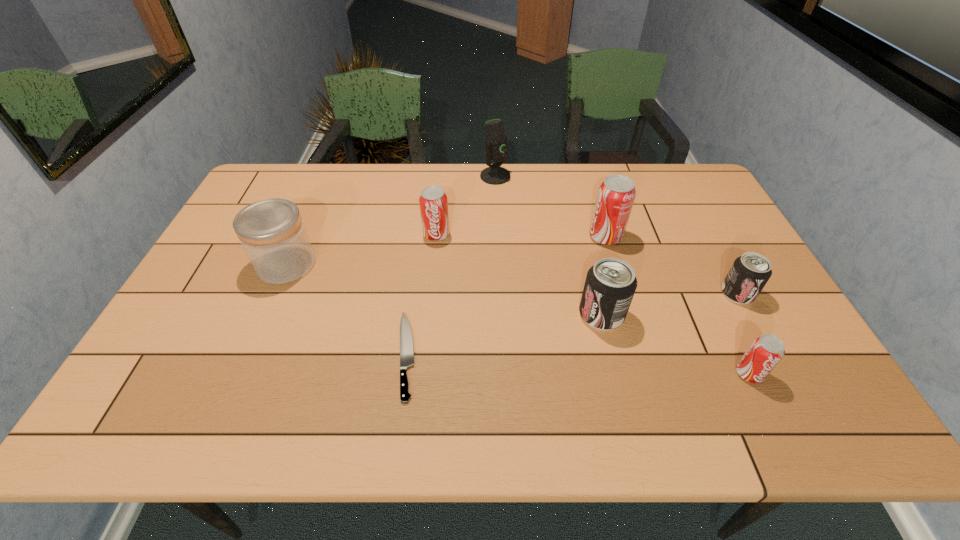
I want to click on microphone, so click(496, 149).

Image resolution: width=960 pixels, height=540 pixels. In order to click on the fifth object from right to left in this screenshot , I will do `click(496, 149)`.

The height and width of the screenshot is (540, 960). Identify the location of the biggest red soda can. (616, 194).

Locate an element on the screen. Image resolution: width=960 pixels, height=540 pixels. the tallest soda can is located at coordinates (616, 194).

The height and width of the screenshot is (540, 960). Identify the location of the leftmost object. (272, 233).

In order to click on the leftmost soda can in this screenshot , I will do `click(433, 201)`.

Identify the location of the leftmost red soda can. This screenshot has height=540, width=960. (433, 201).

You are a GUI agent. You are given a task and a screenshot of the screen. Output one action in this format:
    pyautogui.click(x=<x>, y=<y>)
    Task: Click on the bigger black soda can
    This screenshot has width=960, height=540.
    Given the screenshot: What is the action you would take?
    pyautogui.click(x=610, y=284)

Find the location of a particular element. the right black soda can is located at coordinates (750, 272).

The image size is (960, 540). Identify the location of the smallest red soda can. (766, 351).